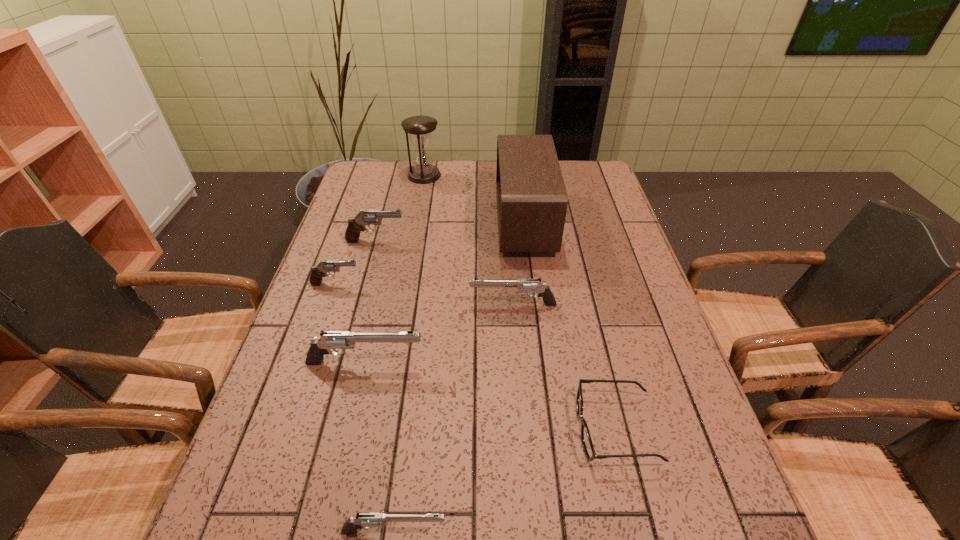
Find the location of a particular element. The image size is (960, 540). silver pistol that is the second closest to the third nearest pistol is located at coordinates [x=368, y=519].